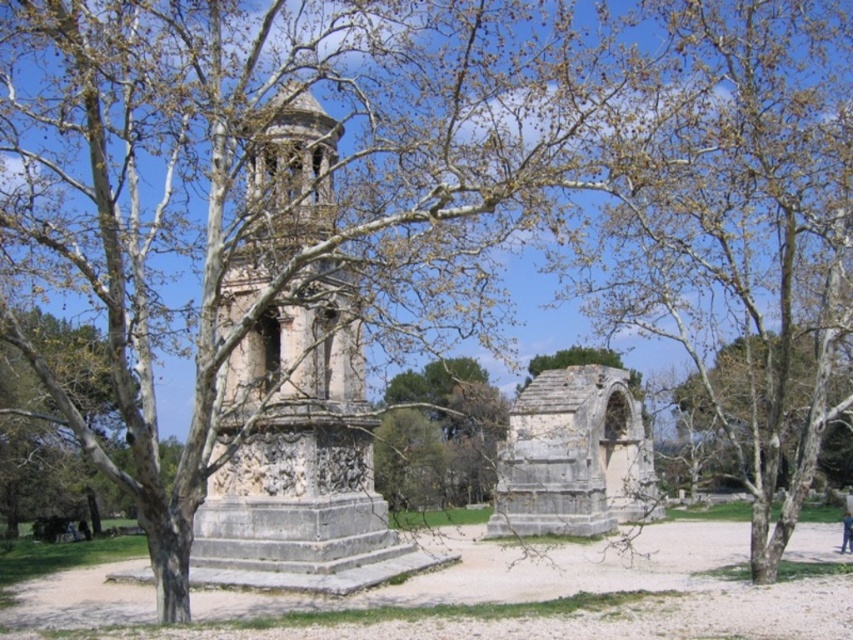
Which is more to the left, stone tower at center or brown leafy tree at center?

stone tower at center

Which of these two, stone tower at center or brown leafy tree at center, stands shorter?

With less height is brown leafy tree at center.

Is point (299, 182) closer to camera compared to point (462, 476)?

That is True.

At what (x,y) coordinates should I click in order to perform the action: click on stone tower at center. Please return your answer as a coordinate pair (x, y). Image resolution: width=853 pixels, height=640 pixels. Looking at the image, I should click on (297, 460).

Identify the location of gray stone arch at center. Image resolution: width=853 pixels, height=640 pixels. (573, 458).

Measure the distance from gray stone arch at center to brown leafy tree at center.

gray stone arch at center is 13.40 meters from brown leafy tree at center.

What are the coordinates of `gray stone arch at center` in the screenshot? It's located at (573, 458).

Is stone tower at center behind gray stone arch at center?

No, stone tower at center is in front of gray stone arch at center.

Is stone tower at center taller than gray stone arch at center?

Correct, stone tower at center is much taller as gray stone arch at center.

Find the location of a particular element. stone tower at center is located at coordinates (297, 460).

Image resolution: width=853 pixels, height=640 pixels. Find the location of `stone tower at center`. stone tower at center is located at coordinates (297, 460).